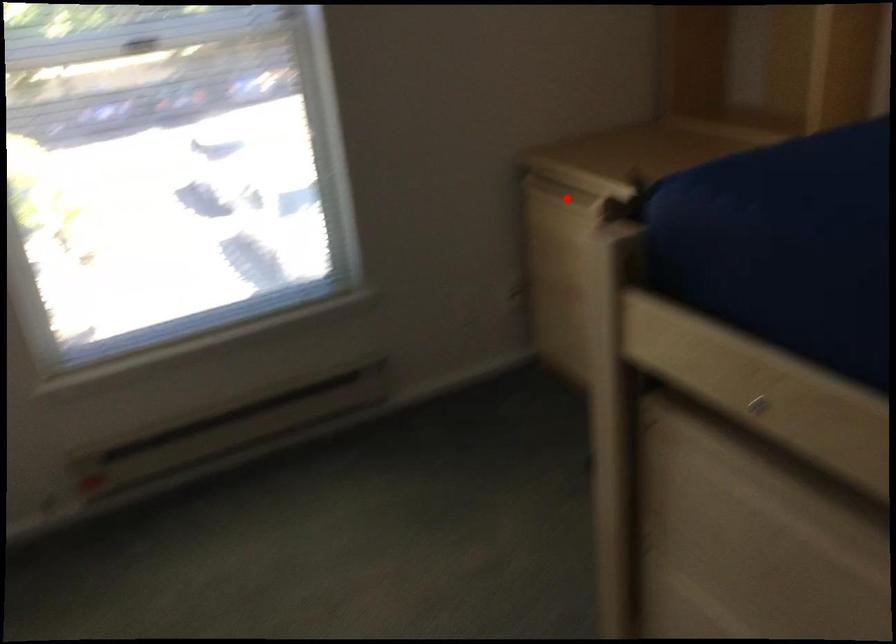
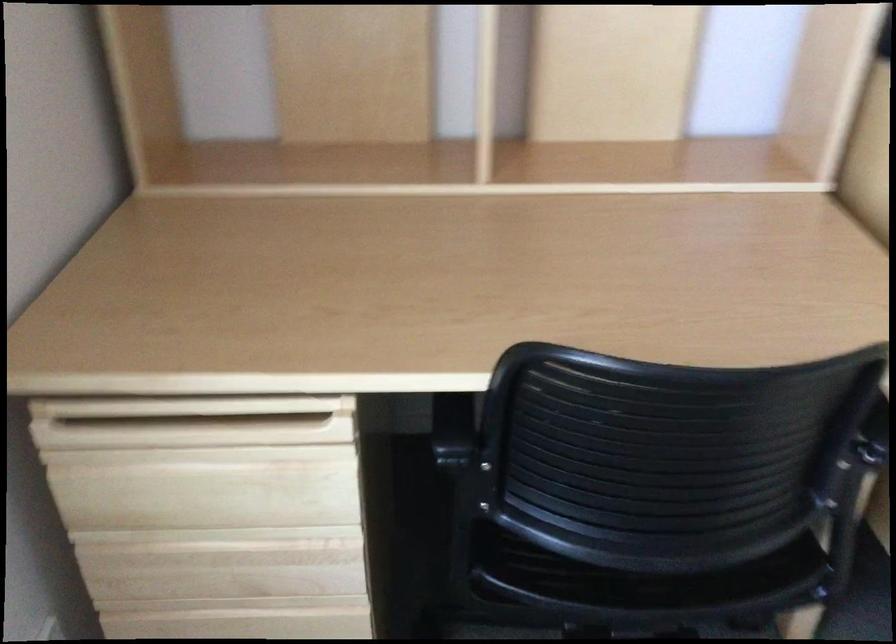
Question: A red point is marked in image1. In image2, is the corresponding 3D point closer to the camera or farther? Reply with the corresponding letter.

Choices:
 (A) The corresponding 3D point is closer.
 (B) The corresponding 3D point is farther.

Answer: (A)